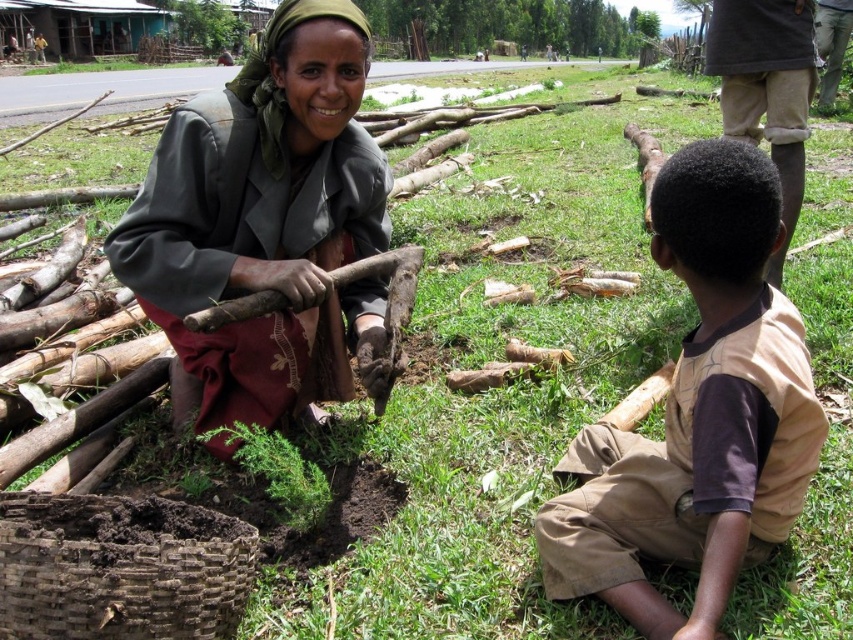
Question: Does brown cotton shirt at center appear over brown woven basket at lower left?

Choices:
 (A) no
 (B) yes

Answer: (B)

Question: Can you confirm if dark gray fabric at center is positioned to the right of brown cotton shirt at center?

Choices:
 (A) no
 (B) yes

Answer: (A)

Question: Which object is closer to the camera taking this photo?

Choices:
 (A) dark gray fabric at center
 (B) brown cotton shirt at center
 (C) brown woven basket at lower left

Answer: (B)

Question: Which point appears closest to the camera in this image?

Choices:
 (A) (306, 317)
 (B) (750, 484)

Answer: (B)

Question: Can you confirm if dark gray fabric at center is positioned to the right of brown cotton shirt at center?

Choices:
 (A) no
 (B) yes

Answer: (A)

Question: Which of the following is the farthest from the observer?

Choices:
 (A) (305, 401)
 (B) (53, 504)

Answer: (A)